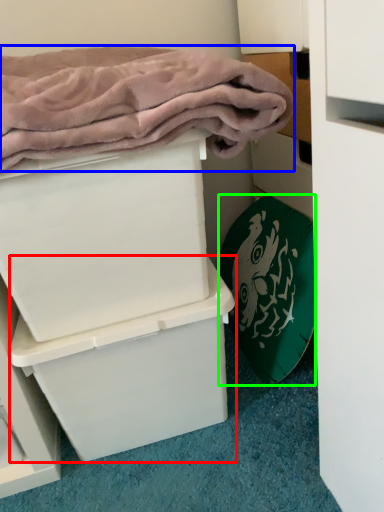
Question: Considering the real-world distances, which object is closest to box (highlighted by a red box)? bath towel (highlighted by a blue box) or bath towel (highlighted by a green box).

Choices:
 (A) bath towel
 (B) bath towel

Answer: (B)